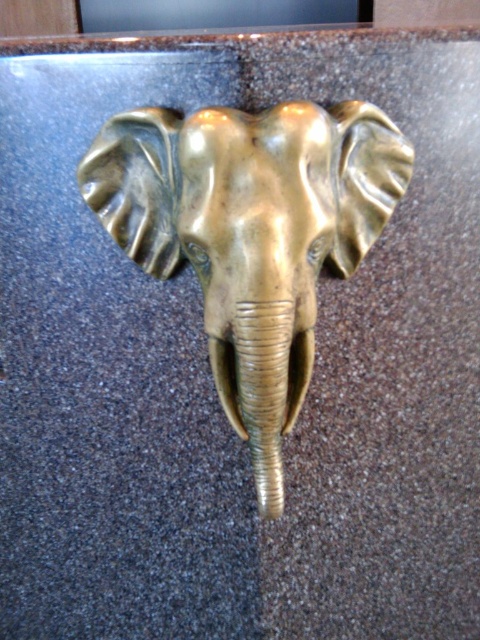
The elephant head is positioned at the center of the image. If you were to draw a straight line from the bottom edge of the image to the point marked by coordinates point (251, 234), would this line pass through the elephant head?

Yes, the line would pass through the gold polished elephant head at center because the point marks its location.

You are an art conservator examining the sculpture. You notice that the gold polished elephant head at center and the gold textured tusk at center are both made of brass. Which object is placed above the other?

The gold polished elephant head at center is positioned over the gold textured tusk at center, so the elephant head is above the tusk.

You are standing in front of the metallic elephant sculpture. There are two points marked on the stone surface. One is at coordinates point (166, 118) and the other is at point (240, 417). If you want to move from the point closer to you to the one further away, which point should you start at?

You should start at point (166, 118) because it is in front of point (240, 417), meaning it is closer to you. Moving from there to point (240, 417) would take you towards the back.